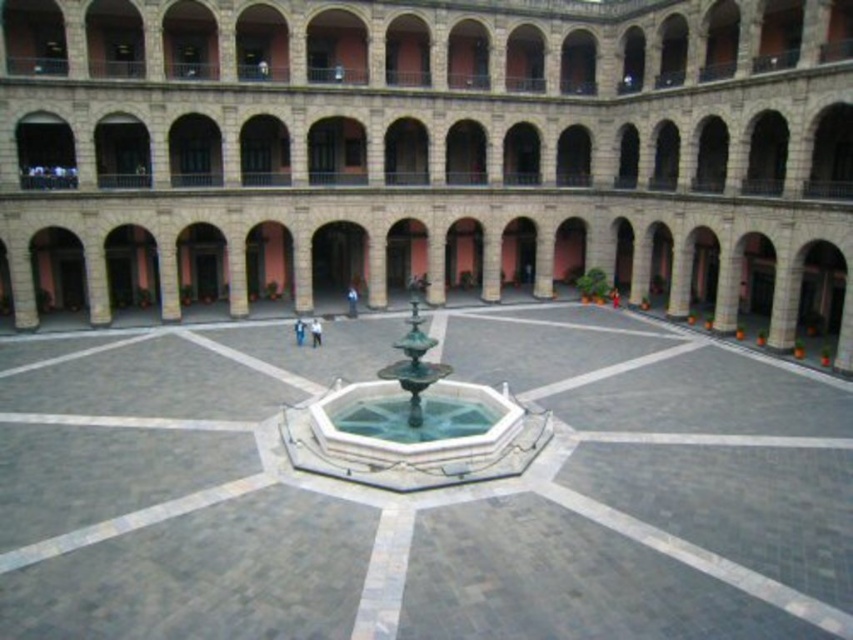
What do you see at coordinates (428, 154) in the screenshot? I see `gray stone fountain at center` at bounding box center [428, 154].

Does gray stone fountain at center appear over green marble fountain at center?

Yes.

Is point (814, 138) less distant than point (291, 449)?

No, it is not.

Find the location of a particular element. Image resolution: width=853 pixels, height=640 pixels. gray stone fountain at center is located at coordinates (428, 154).

Is gray stone fountain at center taller than polished stone fountain at center?

Yes.

Measure the distance between point (169, 305) and camera.

71.72 meters

Where is `gray stone fountain at center`? This screenshot has width=853, height=640. gray stone fountain at center is located at coordinates (428, 154).

Is polished stone fountain at center thinner than green marble fountain at center?

In fact, polished stone fountain at center might be wider than green marble fountain at center.

This screenshot has width=853, height=640. Identify the location of polished stone fountain at center. (422, 492).